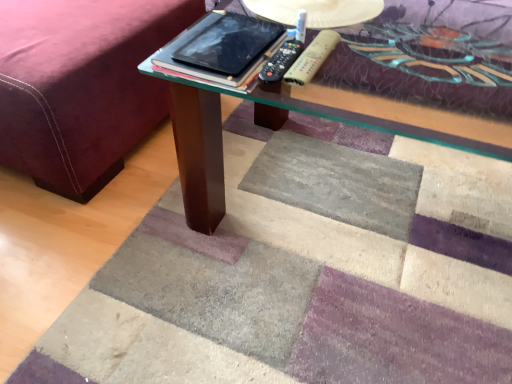
At what (x,y) coordinates should I click in order to perform the action: click on vacant area in front of velvet maroon bed frame at lower left. Please return your answer as a coordinate pair (x, y). This screenshot has height=384, width=512. Looking at the image, I should click on (113, 256).